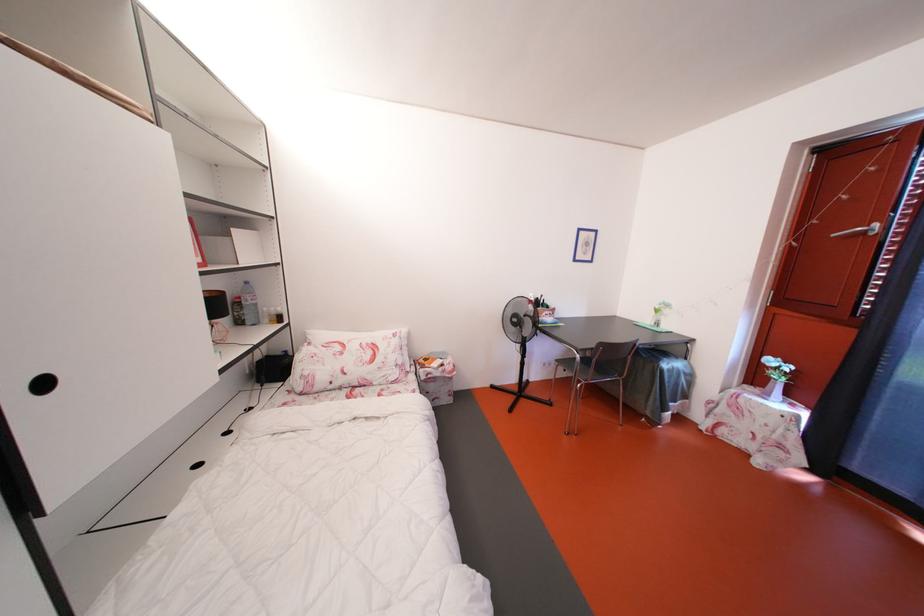
Describe the element at coordinates (43, 384) in the screenshot. The width and height of the screenshot is (924, 616). I see `the black circular handle` at that location.